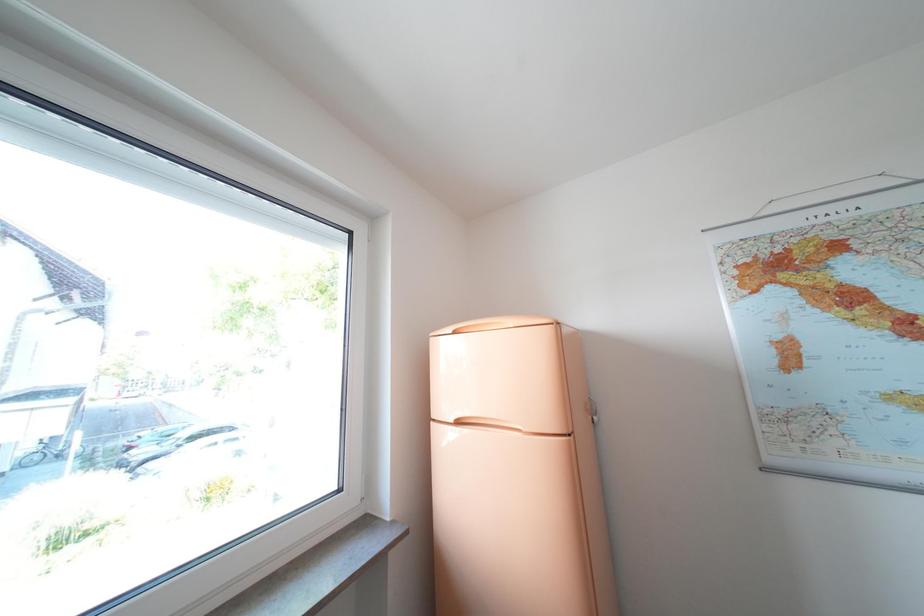
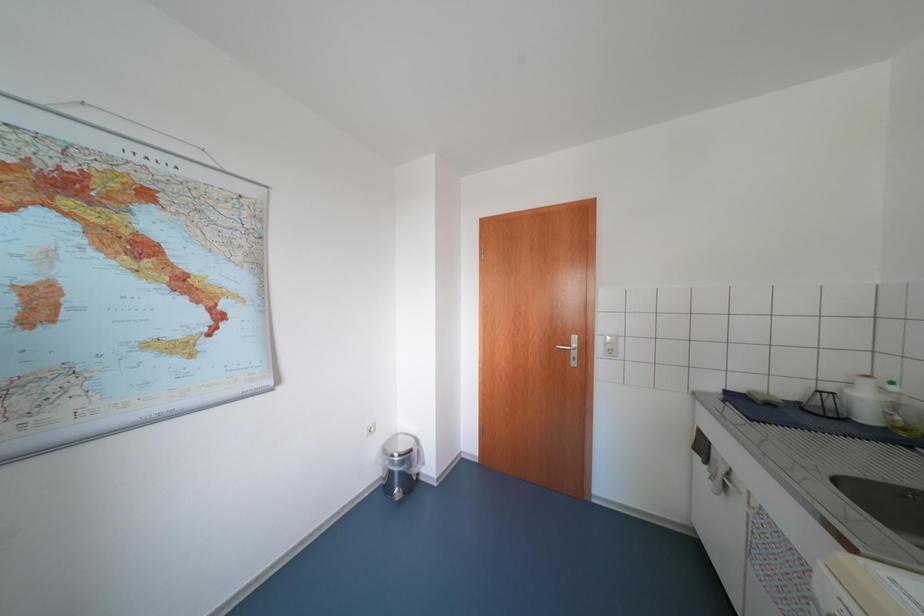
Question: The camera is either moving clockwise (left) or counter-clockwise (right) around the object. The first image is from the beginning of the video and the second image is from the end. Is the camera moving left or right when shooting the video?

Choices:
 (A) Left
 (B) Right

Answer: (A)